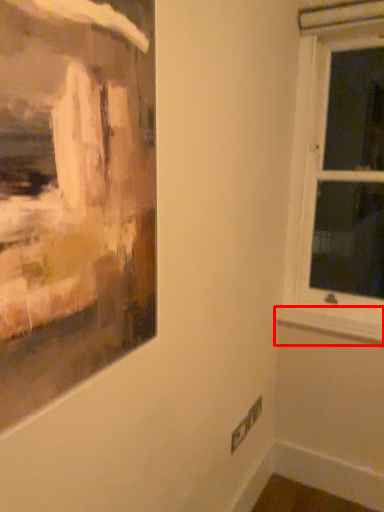
Question: From the image's perspective, considering the relative positions of window sill (annotated by the red box) and window in the image provided, where is window sill (annotated by the red box) located with respect to the staircase?

Choices:
 (A) above
 (B) below

Answer: (B)